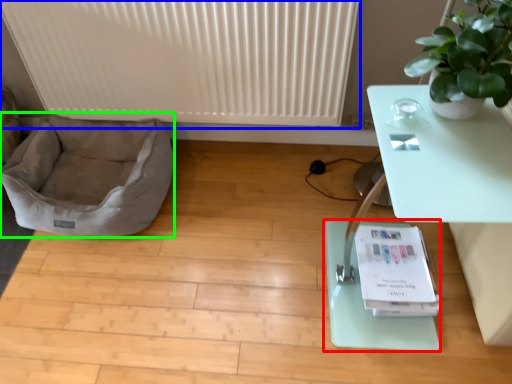
Question: Based on their relative distances, which object is nearer to yoga mat (highlighted by a red box)? Choose from radiator (highlighted by a blue box) and dog bed (highlighted by a green box).

Choices:
 (A) radiator
 (B) dog bed

Answer: (A)